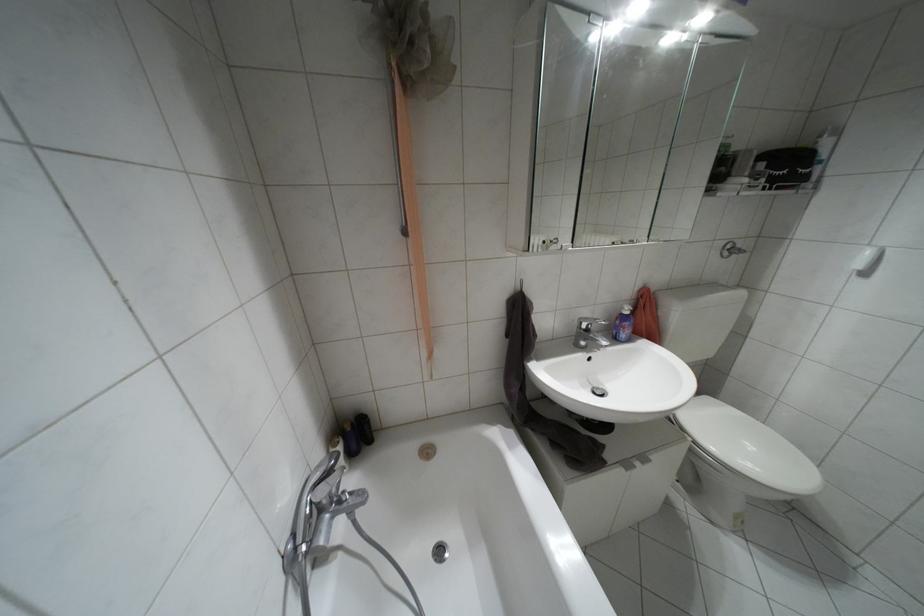
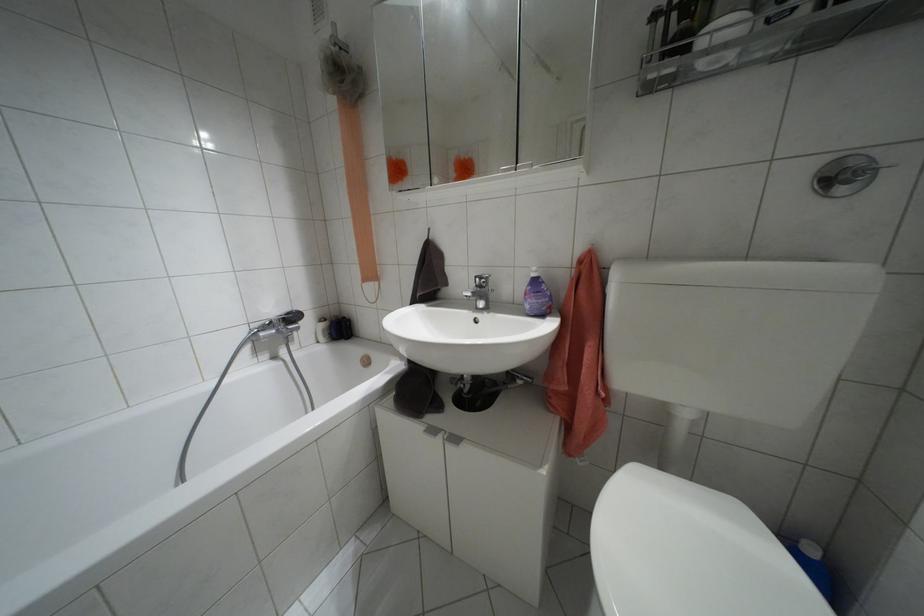
Locate, in the second image, the point that corresponds to (x=626, y=464) in the first image.

(432, 430)